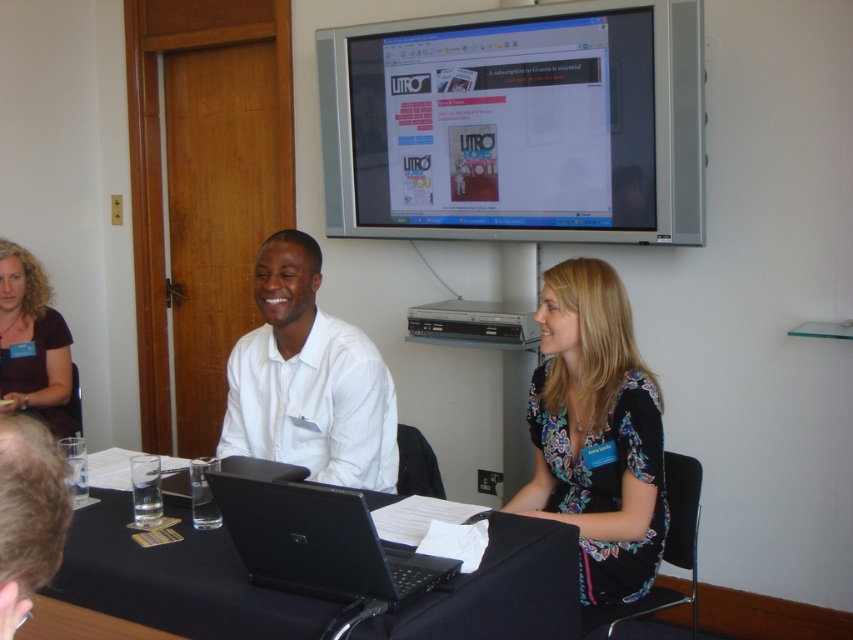
Is floral fabric dress at center behind dark brown hair at lower left?

That is False.

Looking at this image, does floral fabric dress at center have a greater height compared to dark brown hair at lower left?

Correct, floral fabric dress at center is much taller as dark brown hair at lower left.

Does point (601, 349) come behind point (42, 300)?

No, (601, 349) is in front of (42, 300).

The image size is (853, 640). I want to click on floral fabric dress at center, so click(x=596, y=433).

Does white smooth shirt at center have a larger size compared to black glossy laptop at center?

Yes, white smooth shirt at center is bigger than black glossy laptop at center.

Which is behind, point (292, 390) or point (312, 502)?

Point (292, 390)

Image resolution: width=853 pixels, height=640 pixels. What do you see at coordinates (308, 380) in the screenshot?
I see `white smooth shirt at center` at bounding box center [308, 380].

Locate an element on the screen. white smooth shirt at center is located at coordinates (308, 380).

Can you confirm if matte plastic monitor at upper center is wider than black glossy laptop at center?

Indeed, matte plastic monitor at upper center has a greater width compared to black glossy laptop at center.

Which is below, matte plastic monitor at upper center or black glossy laptop at center?

black glossy laptop at center is below.

From the picture: Who is more forward, [405,236] or [297,563]?

Point [297,563]

You are a GUI agent. You are given a task and a screenshot of the screen. Output one action in this format:
    pyautogui.click(x=<x>, y=<y>)
    Task: Click on the matte plastic monitor at upper center
    Image resolution: width=853 pixels, height=640 pixels.
    Given the screenshot: What is the action you would take?
    pyautogui.click(x=517, y=124)